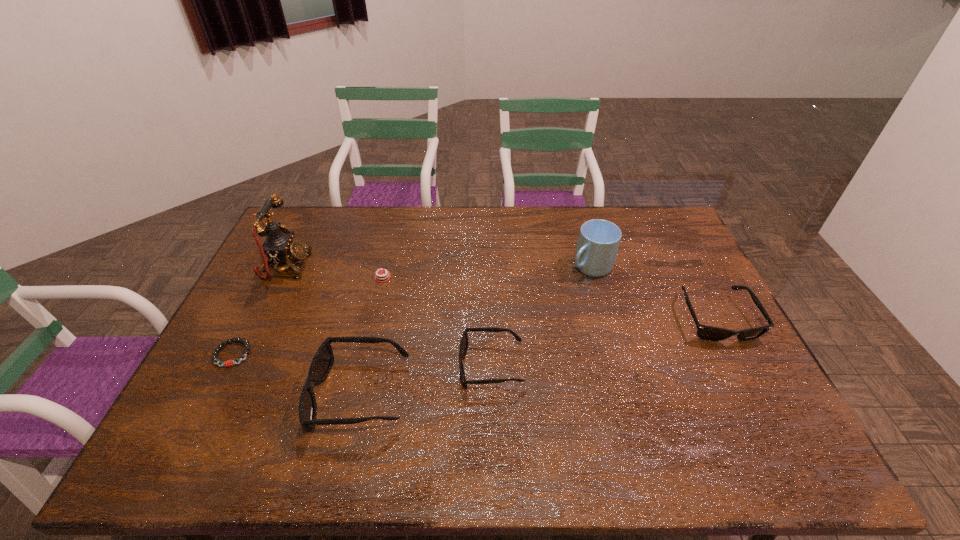
Locate an element on the screen. The image size is (960, 540). vacant point located between the second sunglasses from left to right and the bracelet is located at coordinates (362, 360).

Where is `blank region between the sixth object from left to right and the shortest object`? blank region between the sixth object from left to right and the shortest object is located at coordinates (412, 310).

Where is `vacant space that is in between the sixth tallest object and the mug`? The height and width of the screenshot is (540, 960). vacant space that is in between the sixth tallest object and the mug is located at coordinates (487, 272).

At what (x,y) coordinates should I click in order to perform the action: click on free space between the shortest sunglasses and the leftmost sunglasses. Please return your answer as a coordinate pair (x, y). Image resolution: width=960 pixels, height=540 pixels. Looking at the image, I should click on (425, 380).

At what (x,y) coordinates should I click in order to perform the action: click on vacant space that is in between the second shortest sunglasses and the bracelet. Please return your answer as a coordinate pair (x, y). This screenshot has width=960, height=540. Looking at the image, I should click on (474, 336).

Where is `vacant area that lies between the tallest object and the leftmost sunglasses`? vacant area that lies between the tallest object and the leftmost sunglasses is located at coordinates (323, 330).

Identify the location of free space between the leftmost sunglasses and the shortest sunglasses. This screenshot has width=960, height=540. (425, 380).

Where is `unoccupied position between the sixth tallest object and the fourth shortest object`? unoccupied position between the sixth tallest object and the fourth shortest object is located at coordinates (549, 298).

This screenshot has height=540, width=960. I want to click on vacant region between the sixth tallest object and the tallest object, so click(334, 272).

Locate an element on the screen. This screenshot has width=960, height=540. object that is the third closest one to the telephone is located at coordinates (323, 360).